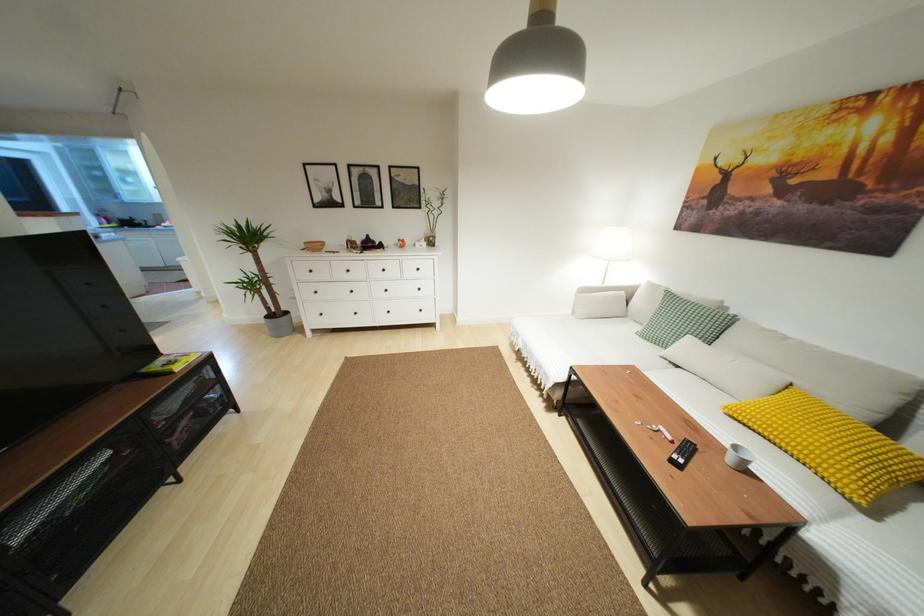
Where is `black remote control`? Image resolution: width=924 pixels, height=616 pixels. black remote control is located at coordinates (682, 454).